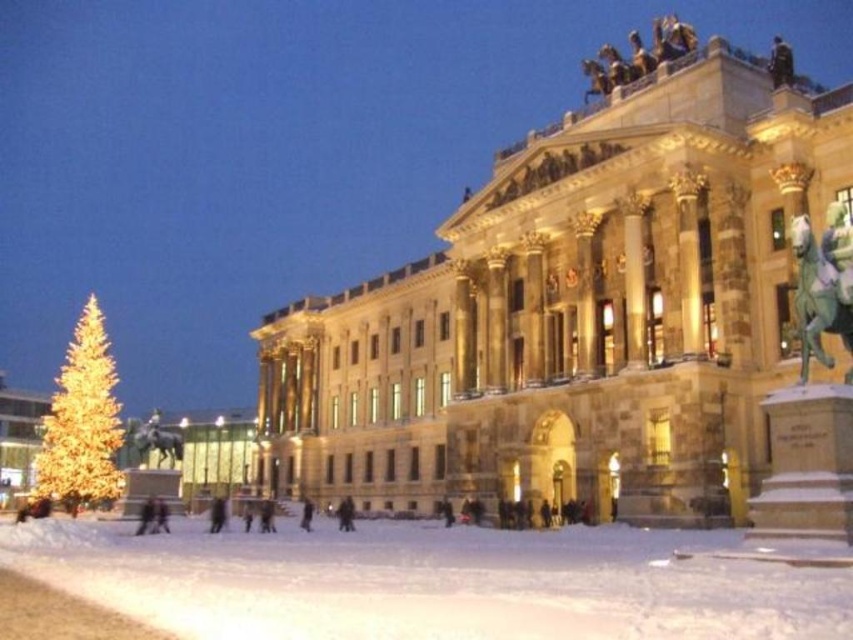
Question: Can you confirm if stone/brick palace at center is bigger than dark brown fur coat at center?

Choices:
 (A) yes
 (B) no

Answer: (A)

Question: Which object is positioned closest to the stone/brick palace at center?

Choices:
 (A) polished bronze statue at lower left
 (B) dark gray fabric coat at center

Answer: (B)

Question: Estimate the real-world distances between objects in this image. Which object is closer to the polished bronze statue at lower left?

Choices:
 (A) illuminated gold christmas tree at lower left
 (B) green patina bronze horse at upper right
 (C) dark brown fur coat at center
 (D) white powdery snow at lower center

Answer: (A)

Question: Which object appears farthest from the camera in this image?

Choices:
 (A) dark gray fabric coat at center
 (B) stone/brick palace at center
 (C) dark brown fur coat at center
 (D) white powdery snow at lower center

Answer: (C)

Question: Does stone/brick palace at center appear over polished bronze statue at lower left?

Choices:
 (A) yes
 (B) no

Answer: (A)

Question: Can you confirm if white powdery snow at lower center is smaller than dark gray fabric coat at center?

Choices:
 (A) no
 (B) yes

Answer: (A)